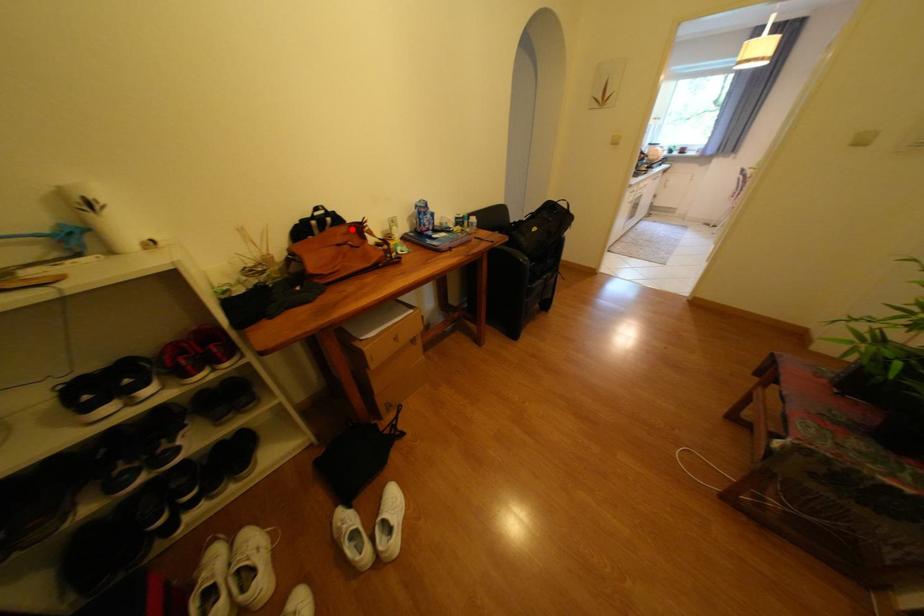
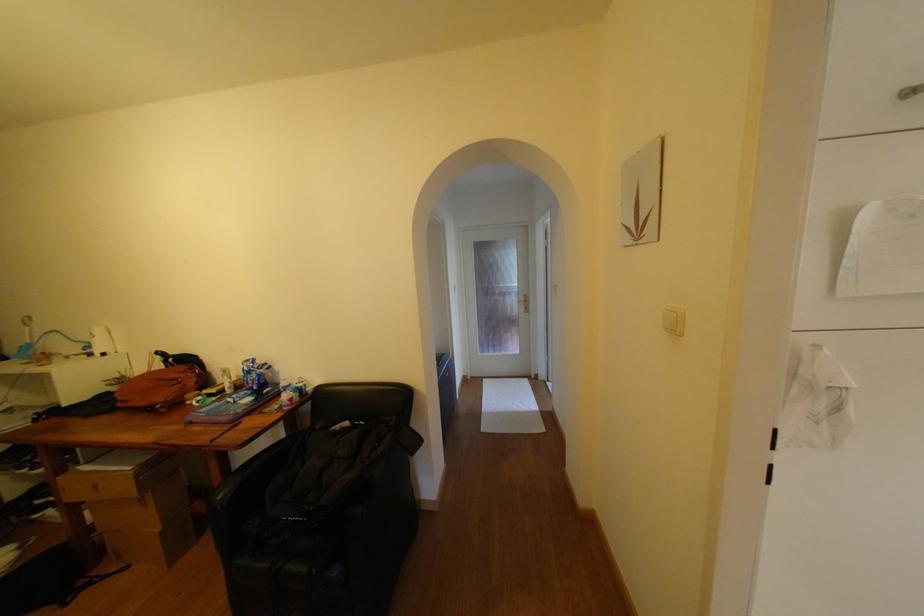
In the second image, find the point that corresponds to the highlighted location in the first image.

(190, 369)